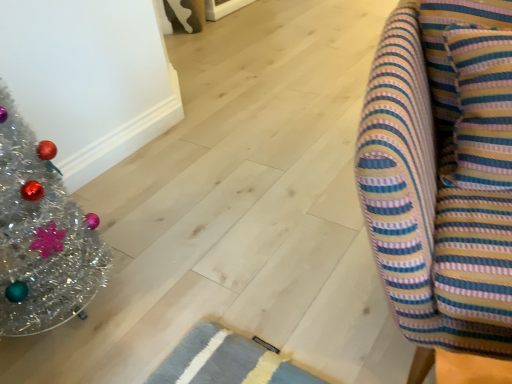
Question: Is shiny silver christmas tree at left looking in the opposite direction of striped fabric couch at right?

Choices:
 (A) no
 (B) yes

Answer: (A)

Question: Are shiny silver christmas tree at left and striped fabric couch at right located far from each other?

Choices:
 (A) yes
 (B) no

Answer: (B)

Question: Considering the relative sizes of shiny silver christmas tree at left and striped fabric couch at right in the image provided, is shiny silver christmas tree at left taller than striped fabric couch at right?

Choices:
 (A) no
 (B) yes

Answer: (B)

Question: Does shiny silver christmas tree at left lie behind striped fabric couch at right?

Choices:
 (A) yes
 (B) no

Answer: (A)

Question: Is shiny silver christmas tree at left aimed at striped fabric couch at right?

Choices:
 (A) yes
 (B) no

Answer: (B)

Question: Is shiny silver christmas tree at left positioned in front of striped fabric couch at right?

Choices:
 (A) yes
 (B) no

Answer: (B)

Question: Does striped fabric couch at right have a lesser height compared to shiny silver christmas tree at left?

Choices:
 (A) no
 (B) yes

Answer: (B)

Question: Is the depth of striped fabric couch at right greater than that of shiny silver christmas tree at left?

Choices:
 (A) yes
 (B) no

Answer: (B)

Question: Is striped fabric couch at right smaller than shiny silver christmas tree at left?

Choices:
 (A) no
 (B) yes

Answer: (A)

Question: From the image's perspective, is striped fabric couch at right on shiny silver christmas tree at left?

Choices:
 (A) no
 (B) yes

Answer: (B)

Question: Is striped fabric couch at right positioned with its back to shiny silver christmas tree at left?

Choices:
 (A) no
 (B) yes

Answer: (A)

Question: Is striped fabric couch at right wider than shiny silver christmas tree at left?

Choices:
 (A) yes
 (B) no

Answer: (A)

Question: From the image's perspective, is striped fabric couch at right above or below shiny silver christmas tree at left?

Choices:
 (A) below
 (B) above

Answer: (B)